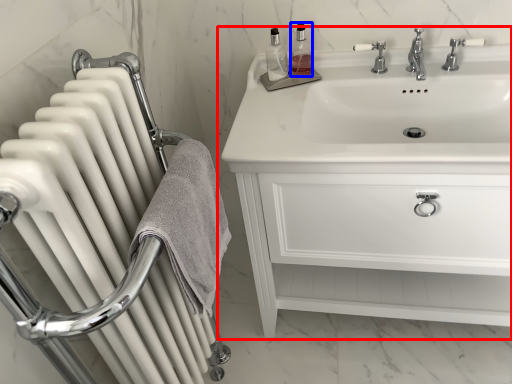
Question: Among these objects, which one is nearest to the camera, bathroom cabinet (highlighted by a red box) or soap dispenser (highlighted by a blue box)?

Choices:
 (A) bathroom cabinet
 (B) soap dispenser

Answer: (A)